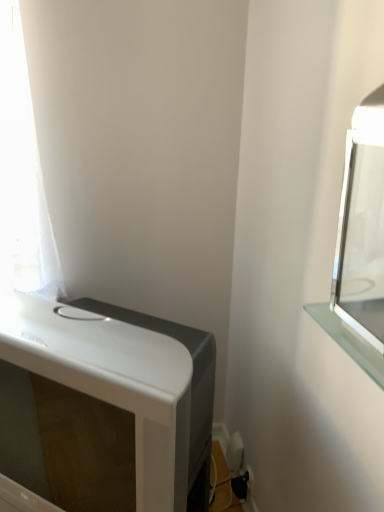
You are a GUI agent. You are given a task and a screenshot of the screen. Output one action in this format:
    pyautogui.click(x=<x>, y=<y>)
    Task: Click on the white glossy desktop at lower left
    
    Given the screenshot: What is the action you would take?
    pyautogui.click(x=105, y=405)

What is the approximate height of white glossy desktop at lower left?

The height of white glossy desktop at lower left is 19.91 inches.

What do you see at coordinates (105, 405) in the screenshot? The image size is (384, 512). I see `white glossy desktop at lower left` at bounding box center [105, 405].

What are the coordinates of `white glossy desktop at lower left` in the screenshot? It's located at (105, 405).